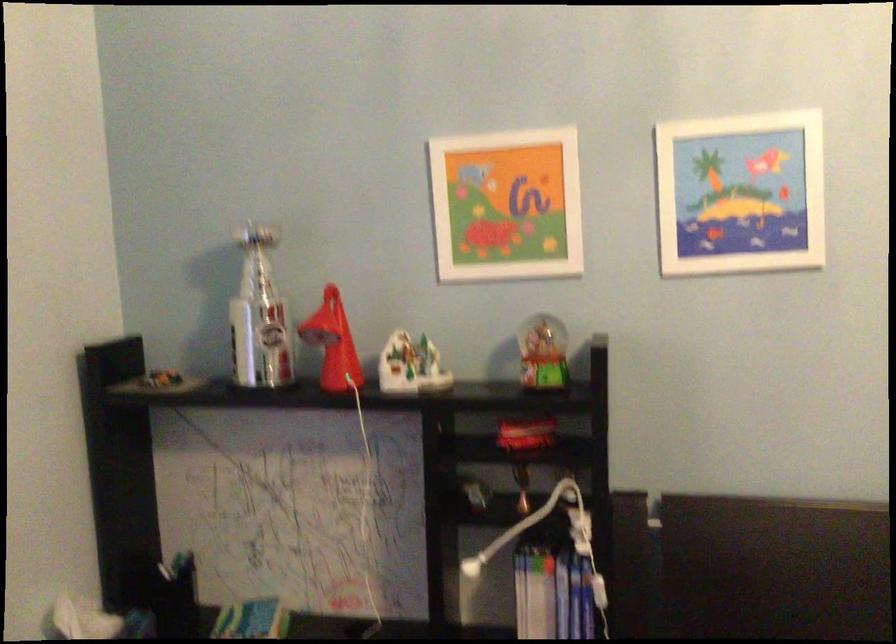
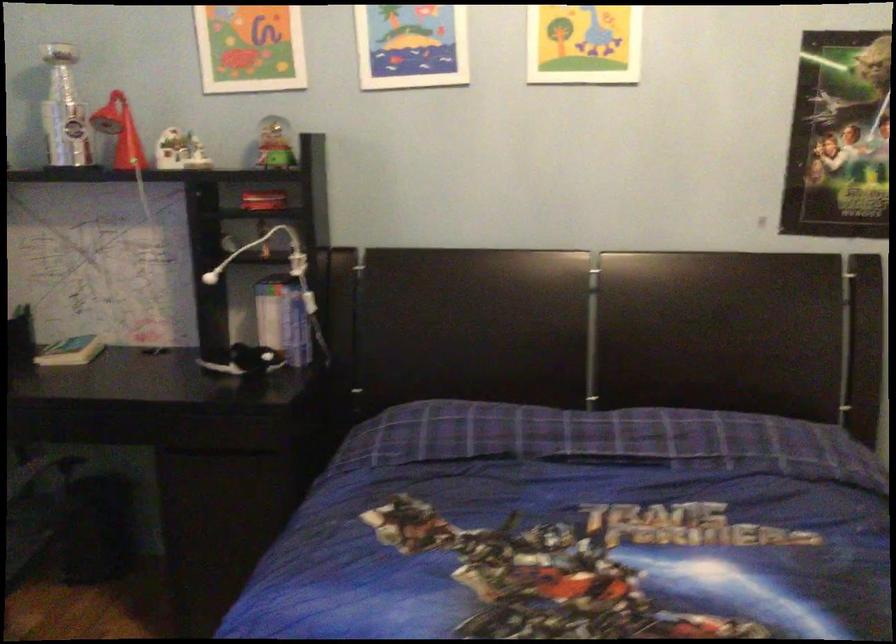
Find the pixel in the second image that matches [334,345] in the first image.

(119, 131)